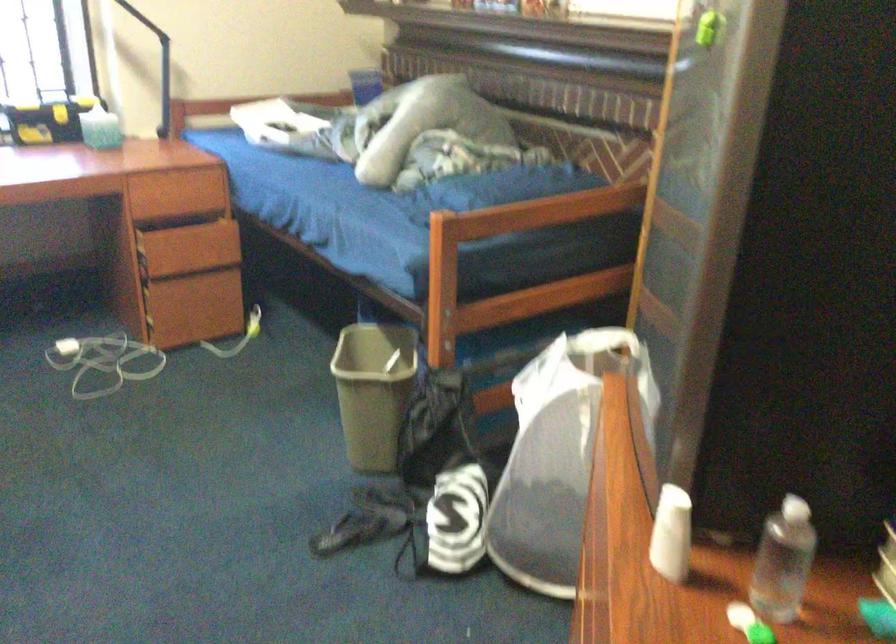
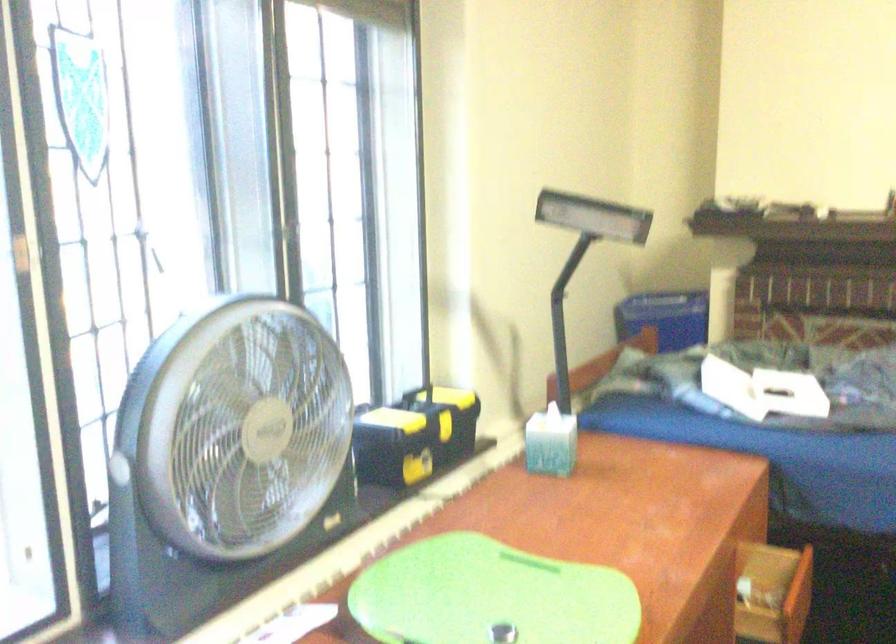
In a continuous first-person perspective shot, in which direction is the camera moving?

The cameraman moved toward left, forward.